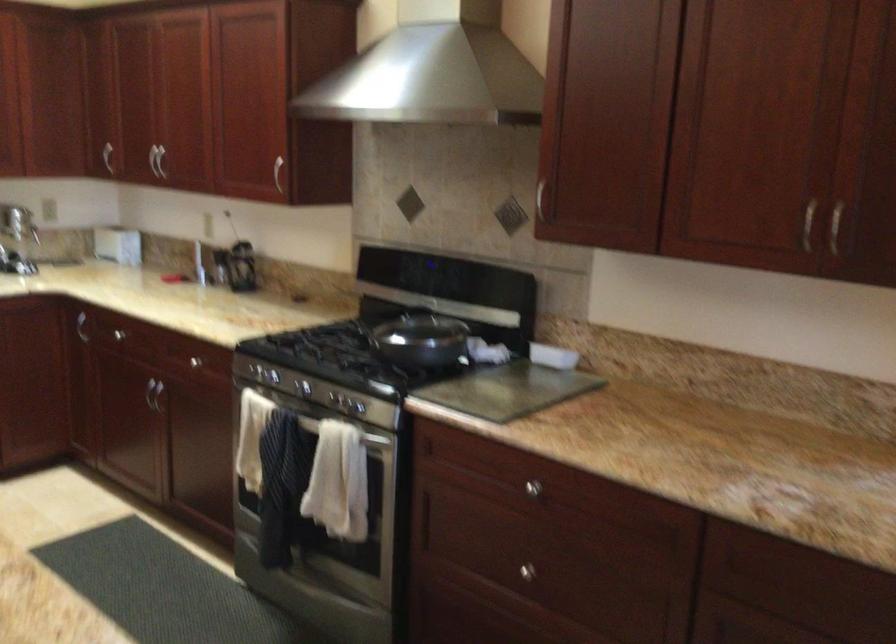
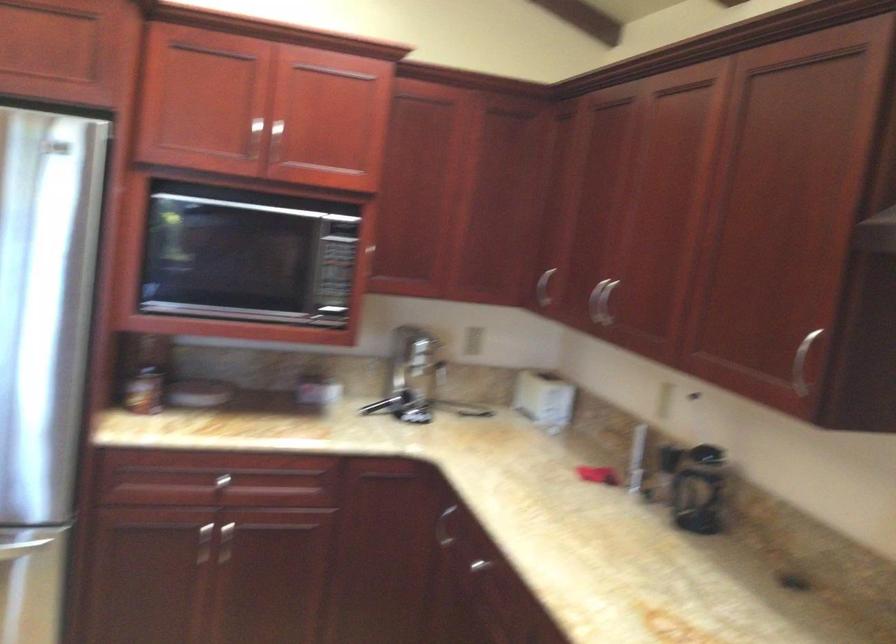
Where in the second image is the point corresponding to (x=101, y=147) from the first image?

(544, 287)